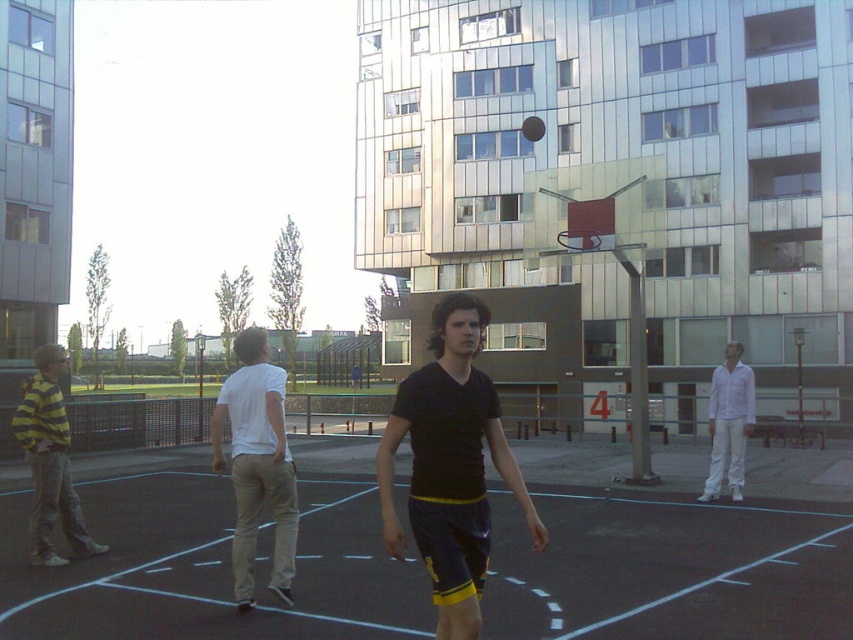
You are a referee standing at the edge of the basketball court. You need to ensure players maintain a minimum distance of 5 feet apart for safety. Are the white cotton shirt at center and the yellow striped hoodie at left complying with this rule?

The distance between the white cotton shirt at center and the yellow striped hoodie at left is 7.50 feet, which is greater than the required 5 feet. Therefore, they are complying with the safety rule.

You are a photographer standing at the edge of the basketball court. You want to take a photo that includes both the yellow striped hoodie at left and the shiny black basketball at center. Which object should you focus on first to ensure both are in sharp focus?

You should focus on the yellow striped hoodie at left first because it is closer to the viewer than the shiny black basketball at center, so adjusting focus from near to far will help both be in focus.

You are standing at the point with coordinates point (32, 403) and want to move to the point with coordinates point (244, 448). Is the point you want to reach in front of you or behind you?

The point (244, 448) is in front of point (32, 403), so the point you want to reach is in front of you.